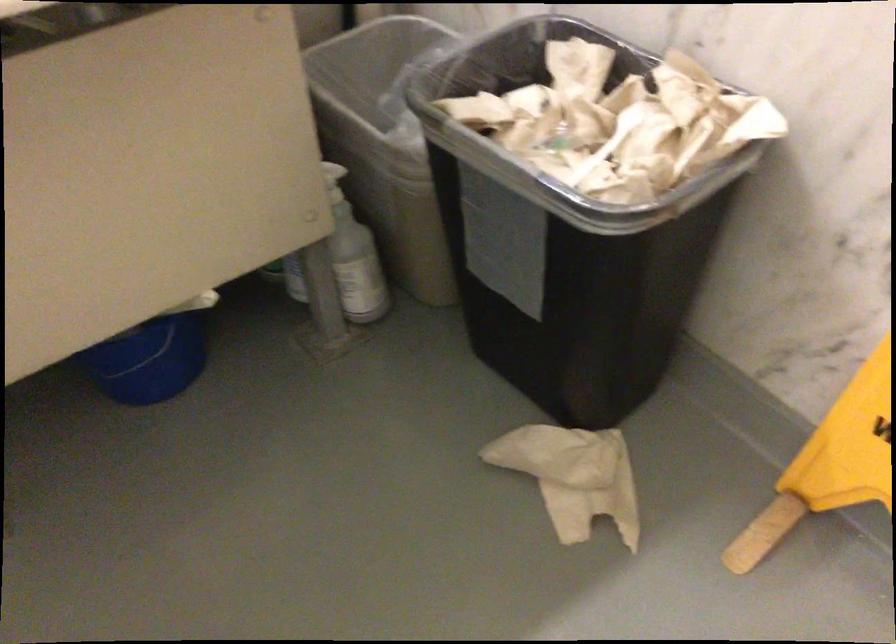
Find the location of `blue bucket handle`. blue bucket handle is located at coordinates (149, 361).